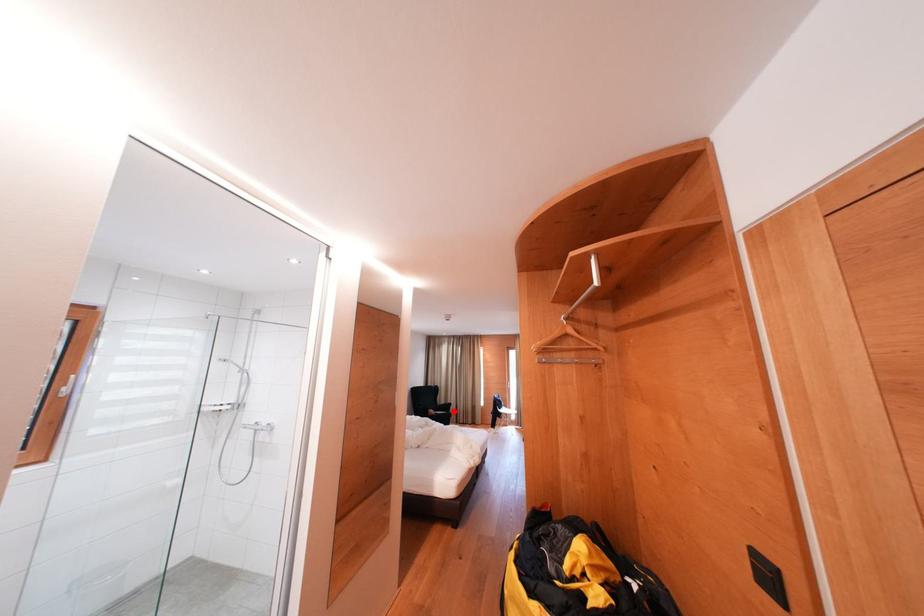
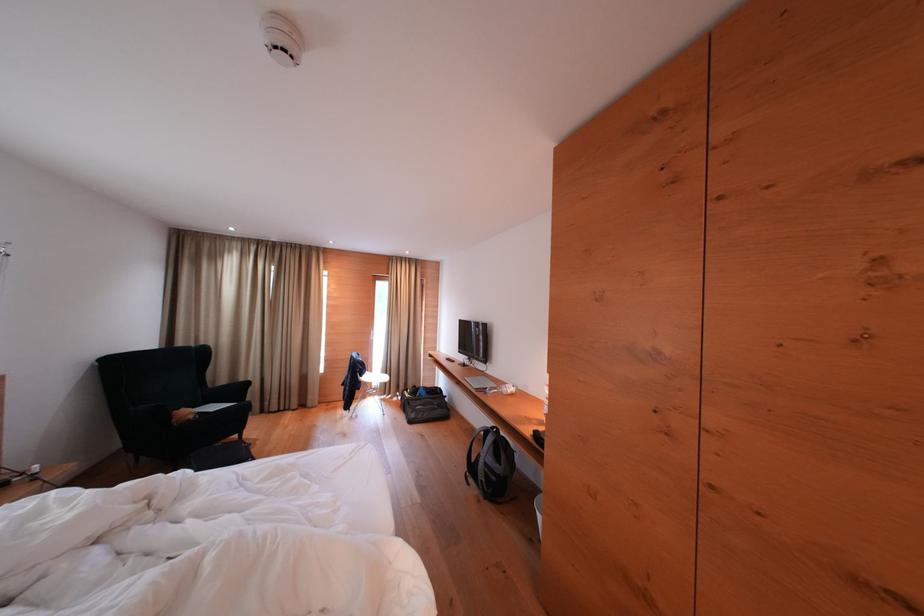
Where in the second image is the point corresponding to the highlighted location from the first image?

(244, 394)